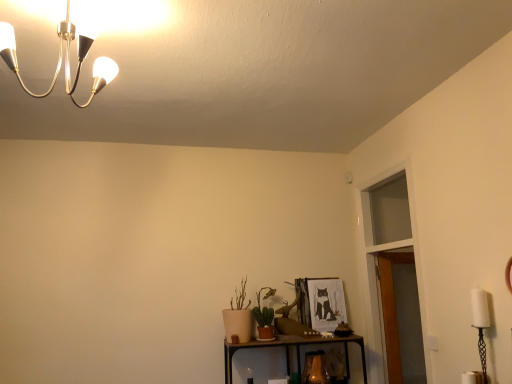
Question: Does green matte cactus at center have a lesser width compared to transparent glass door at upper right?

Choices:
 (A) no
 (B) yes

Answer: (A)

Question: From the image's perspective, does green matte cactus at center appear higher than transparent glass door at upper right?

Choices:
 (A) no
 (B) yes

Answer: (A)

Question: Does green matte cactus at center have a greater height compared to transparent glass door at upper right?

Choices:
 (A) no
 (B) yes

Answer: (A)

Question: Does green matte cactus at center lie in front of transparent glass door at upper right?

Choices:
 (A) yes
 (B) no

Answer: (B)

Question: Can you confirm if green matte cactus at center is bigger than transparent glass door at upper right?

Choices:
 (A) yes
 (B) no

Answer: (B)

Question: Is transparent glass door at upper right inside green matte cactus at center?

Choices:
 (A) no
 (B) yes

Answer: (A)

Question: Is transparent glass door at upper right closer to camera compared to green matte cactus at center?

Choices:
 (A) yes
 (B) no

Answer: (A)

Question: Is transparent glass door at upper right taller than green matte cactus at center?

Choices:
 (A) yes
 (B) no

Answer: (A)

Question: Would you say green matte cactus at center is part of transparent glass door at upper right's contents?

Choices:
 (A) yes
 (B) no

Answer: (B)

Question: From a real-world perspective, does transparent glass door at upper right sit lower than green matte cactus at center?

Choices:
 (A) no
 (B) yes

Answer: (A)

Question: Does transparent glass door at upper right touch green matte cactus at center?

Choices:
 (A) yes
 (B) no

Answer: (B)

Question: Is transparent glass door at upper right located outside green matte cactus at center?

Choices:
 (A) yes
 (B) no

Answer: (A)

Question: From the image's perspective, is transparent glass door at upper right located above or below green matte cactus at center?

Choices:
 (A) below
 (B) above

Answer: (B)